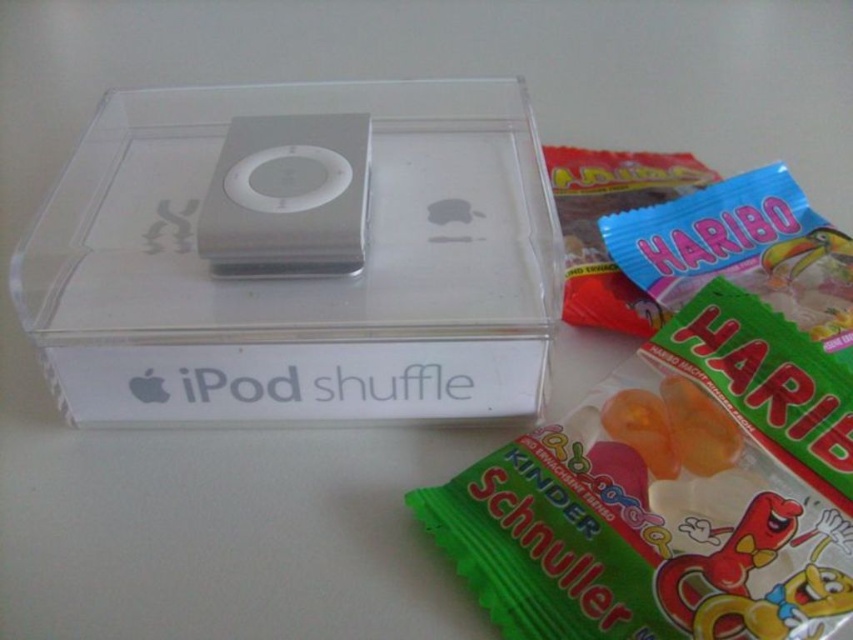
Is point (521, 106) farther from camera compared to point (325, 227)?

Yes, it is.

How far apart are clear plastic ipod shuffle at center and sleek silver ipod shuffle at center?

clear plastic ipod shuffle at center is 3.11 inches away from sleek silver ipod shuffle at center.

Find the location of `clear plastic ipod shuffle at center`. clear plastic ipod shuffle at center is located at coordinates (297, 257).